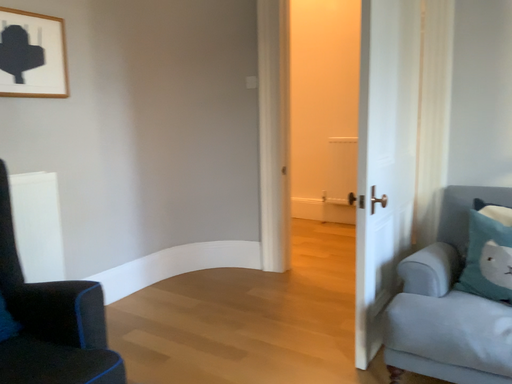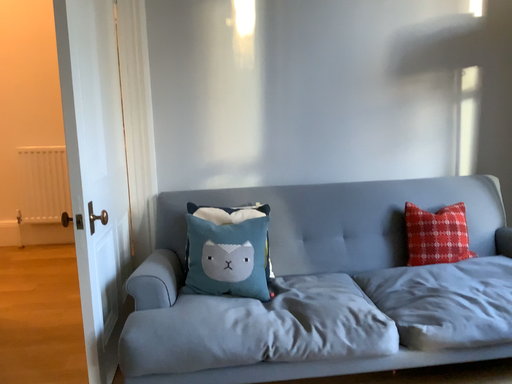
Question: How did the camera likely rotate when shooting the video?

Choices:
 (A) rotated left
 (B) rotated right

Answer: (B)